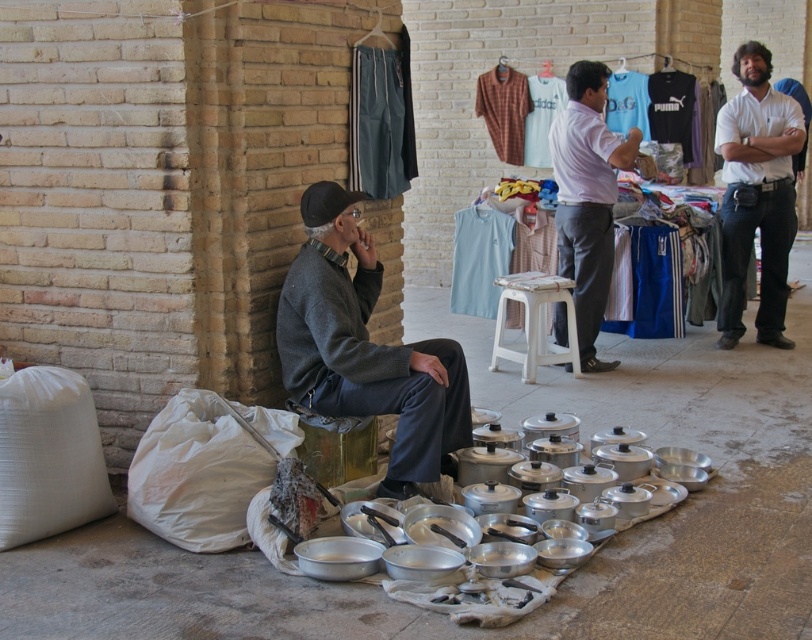
Question: Which point is farther from the camera taking this photo?

Choices:
 (A) (586, 344)
 (B) (543, 314)
 (C) (769, 70)
 (D) (357, 470)

Answer: (B)

Question: Can you confirm if light purple shirt at center is bigger than metallic gold stool at lower center?

Choices:
 (A) no
 (B) yes

Answer: (B)

Question: Does light purple shirt at center have a smaller size compared to metallic gold stool at lower center?

Choices:
 (A) yes
 (B) no

Answer: (B)

Question: Can you confirm if dark gray sweater at center is positioned to the right of light purple shirt at center?

Choices:
 (A) yes
 (B) no

Answer: (B)

Question: Estimate the real-world distances between objects in this image. Which object is closer to the white plastic stool at center?

Choices:
 (A) metallic gold stool at lower center
 (B) dark gray sweater at center
 (C) white cotton shirt at upper right

Answer: (C)

Question: Which object is the farthest from the white cotton shirt at upper right?

Choices:
 (A) dark gray sweater at center
 (B) light purple shirt at center
 (C) metallic gold stool at lower center
 (D) white plastic stool at center

Answer: (C)